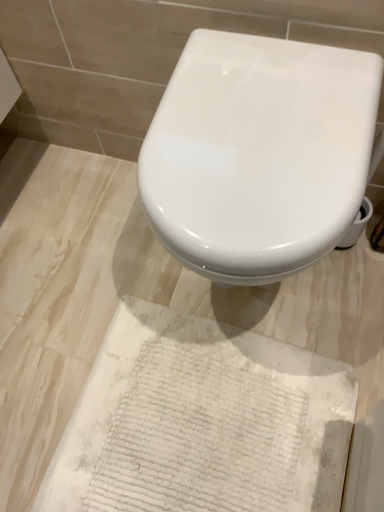
Identify the location of free space to the back side of white textured rug at lower center. (134, 270).